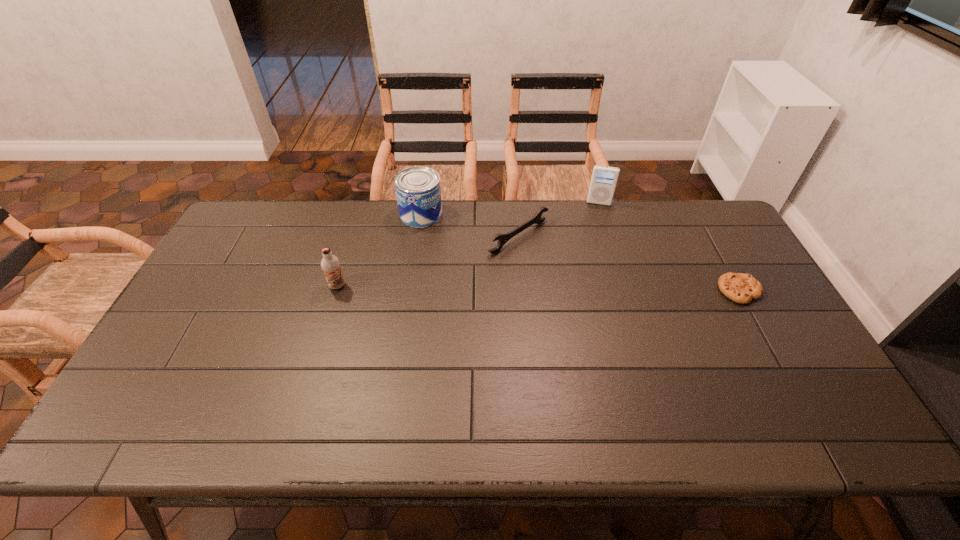
Where is `vacant area situated on the open ends of the third object from right to left`? This screenshot has width=960, height=540. vacant area situated on the open ends of the third object from right to left is located at coordinates (593, 286).

Where is `free point located on the open ends of the third object from right to left`? The height and width of the screenshot is (540, 960). free point located on the open ends of the third object from right to left is located at coordinates (577, 275).

Find the location of a particular element. The width and height of the screenshot is (960, 540). free spot located 0.070m on the front label of the can is located at coordinates (441, 238).

The width and height of the screenshot is (960, 540). Identify the location of vacant space positioned 0.290m on the front label of the can. (475, 279).

Where is `blank space located 0.090m on the front label of the can`? This screenshot has width=960, height=540. blank space located 0.090m on the front label of the can is located at coordinates (444, 241).

Identify the location of free space located 0.270m on the front-facing side of the iPod. (593, 258).

Find the location of a particular element. vacant space positioned on the front-facing side of the iPod is located at coordinates (590, 287).

Where is `free space located 0.360m on the front-facing side of the iPod`? This screenshot has height=540, width=960. free space located 0.360m on the front-facing side of the iPod is located at coordinates (591, 278).

Locate an element on the screen. This screenshot has height=540, width=960. wrench located at the far edge is located at coordinates tap(536, 219).

At what (x,y) coordinates should I click in order to perform the action: click on can located in the far edge section of the desktop. Please return your answer as a coordinate pair (x, y). Image resolution: width=960 pixels, height=540 pixels. Looking at the image, I should click on (418, 192).